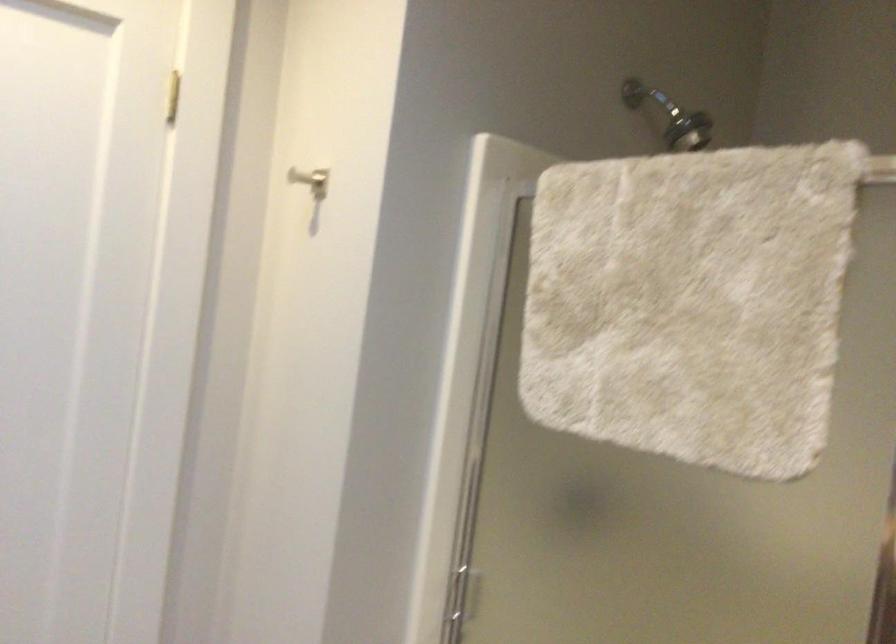
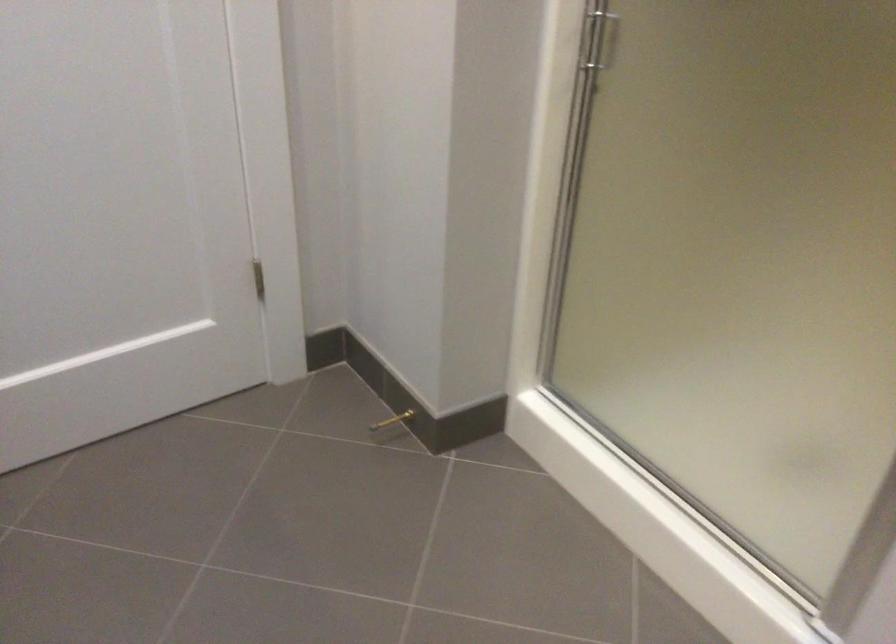
Question: Based on the continuous images, in which direction is the camera rotating? Reply with the corresponding letter.

Choices:
 (A) Left
 (B) Right
 (C) Up
 (D) Down

Answer: (D)